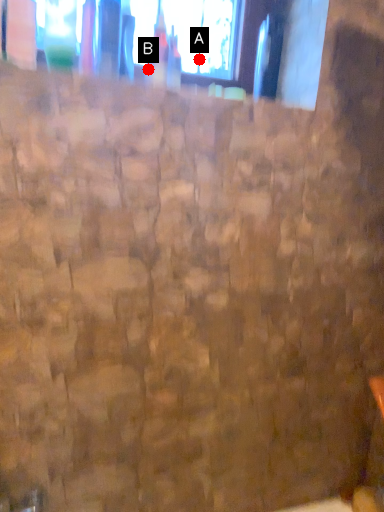
Question: Two points are circled on the image, labeled by A and B beside each circle. Among these points, which one is farthest from the camera?

Choices:
 (A) A is further
 (B) B is further

Answer: (A)